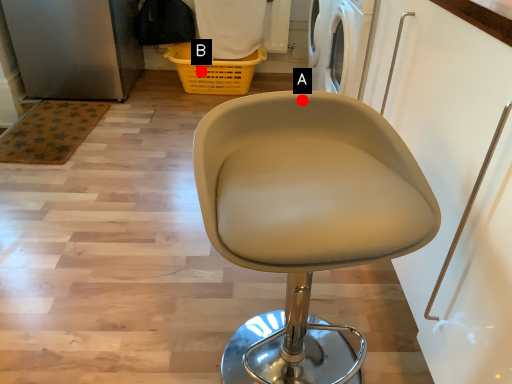
Question: Two points are circled on the image, labeled by A and B beside each circle. Which of the following is the farthest from the observer?

Choices:
 (A) A is further
 (B) B is further

Answer: (B)